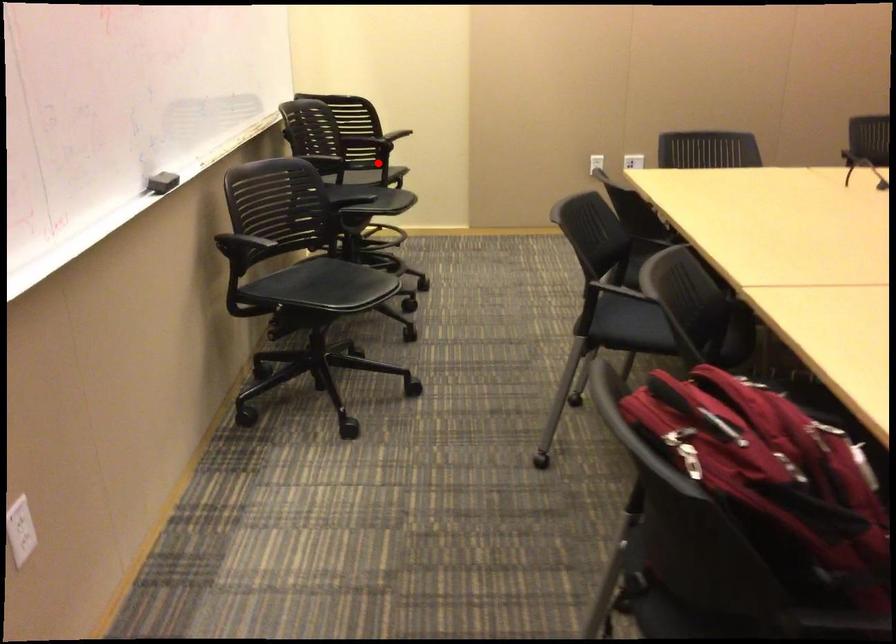
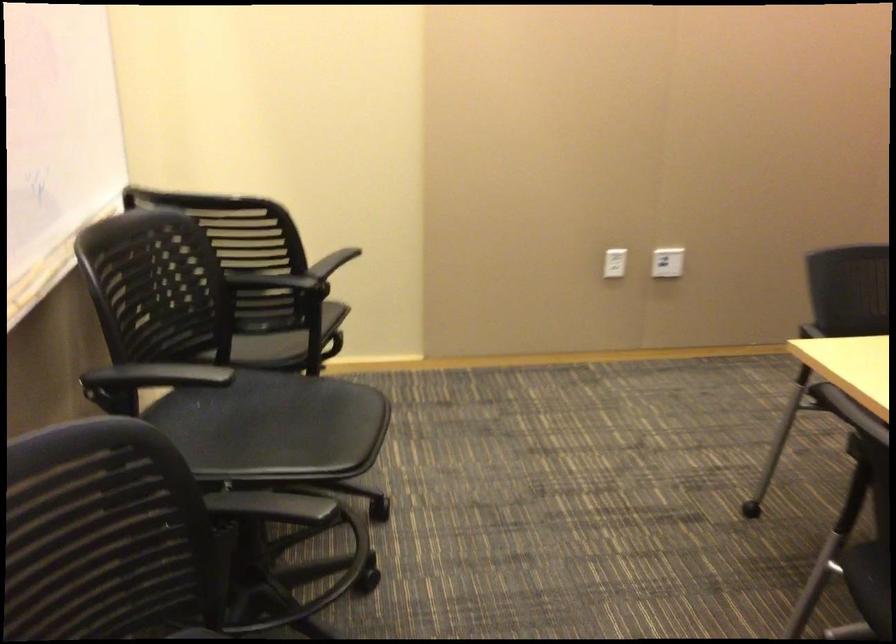
Question: I am providing you with two images of the same scene from different viewpoints. Given a red point in image1, look at the same physical point in image2. Is it:

Choices:
 (A) Closer to the viewpoint
 (B) Farther from the viewpoint

Answer: (A)